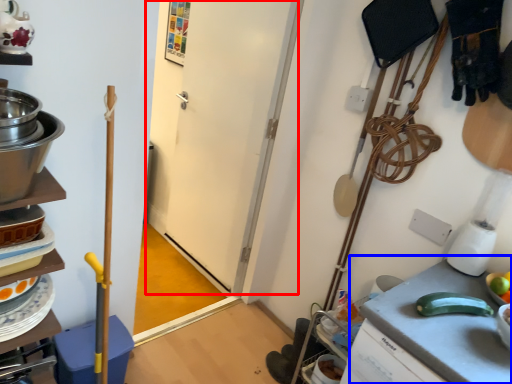
Question: Among these objects, which one is farthest to the camera, door (highlighted by a red box) or counter top (highlighted by a blue box)?

Choices:
 (A) door
 (B) counter top

Answer: (A)